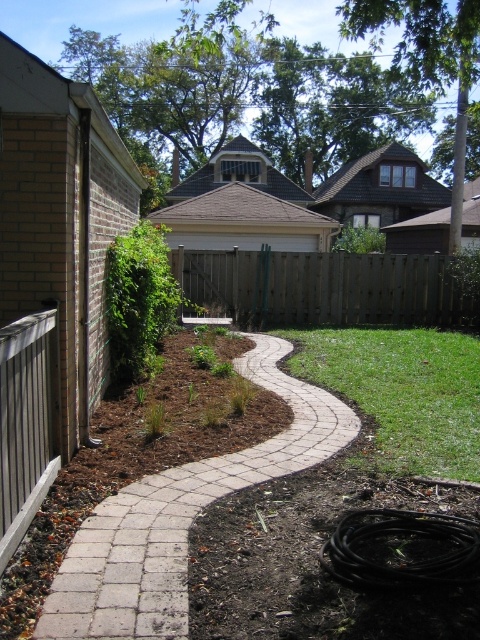
Is point (106, 506) in front of point (348, 353)?

That is True.

Which is more to the right, white brick path at center or green grass at lower right?

green grass at lower right is more to the right.

What are the coordinates of `white brick path at center` in the screenshot? It's located at (180, 516).

Which of these two, white brick path at center or brown wood fence at center, stands taller?

With more height is brown wood fence at center.

Consider the image. Can you confirm if white brick path at center is bigger than brown wood fence at center?

Incorrect, white brick path at center is not larger than brown wood fence at center.

Which is behind, point (171, 561) or point (273, 314)?

Positioned behind is point (273, 314).

Find the location of a particular element. white brick path at center is located at coordinates (180, 516).

Between green grass at lower right and brown wood fence at center, which one appears on the left side from the viewer's perspective?

From the viewer's perspective, green grass at lower right appears more on the left side.

Between point (338, 332) and point (284, 314), which one is positioned behind?

Positioned behind is point (284, 314).

Does point (393, 449) come farther from viewer compared to point (427, 291)?

No.

You are a GUI agent. You are given a task and a screenshot of the screen. Output one action in this format:
    pyautogui.click(x=<x>, y=<y>)
    Task: Click on the green grass at lower right
    Image resolution: width=480 pixels, height=640 pixels.
    Given the screenshot: What is the action you would take?
    pyautogui.click(x=403, y=392)